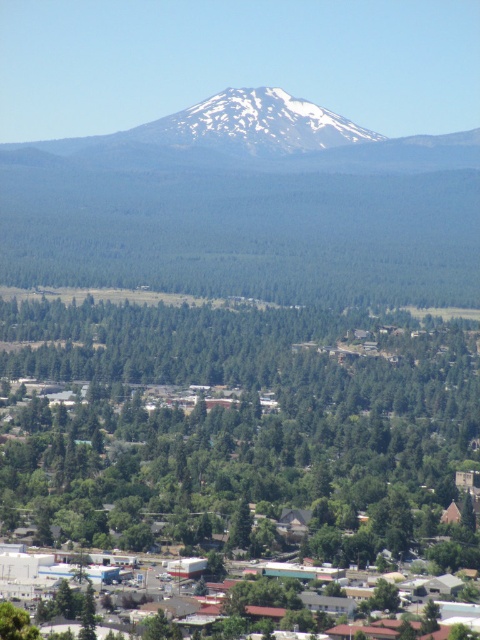
Is green leafy trees at center below white snow-capped mountain at upper center?

Correct, green leafy trees at center is located below white snow-capped mountain at upper center.

Is point (104, 497) farther from viewer compared to point (250, 106)?

No, (104, 497) is closer to viewer.

Identify the location of green leafy trees at center. The width and height of the screenshot is (480, 640). (237, 428).

Find the location of a particular element. green leafy trees at center is located at coordinates (237, 428).